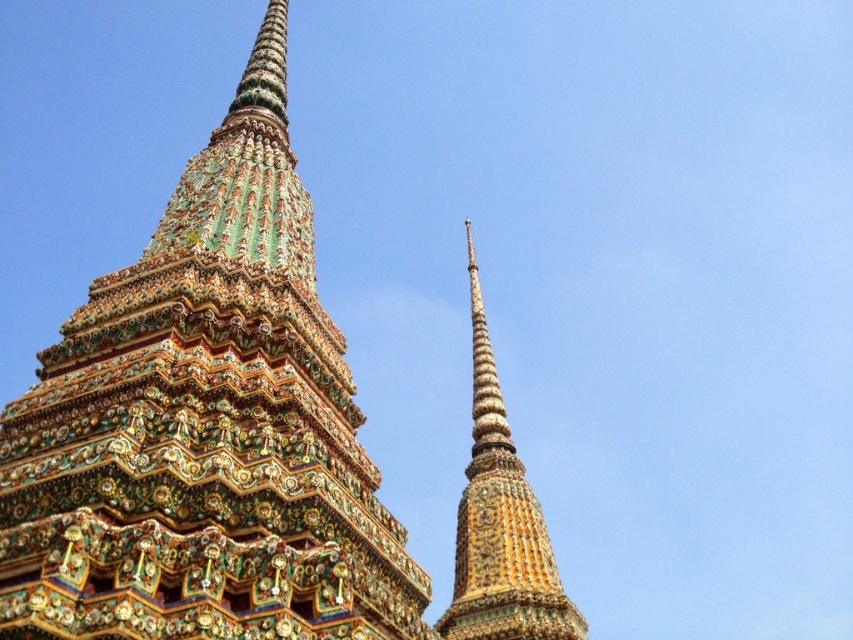
Can you confirm if multicolored mosaic temple spire at center is wider than gold/gilded stupa at center?

Indeed, multicolored mosaic temple spire at center has a greater width compared to gold/gilded stupa at center.

Does point (163, 392) come farther from viewer compared to point (521, 477)?

No.

You are a GUI agent. You are given a task and a screenshot of the screen. Output one action in this format:
    pyautogui.click(x=<x>, y=<y>)
    Task: Click on the multicolored mosaic temple spire at center
    This screenshot has width=853, height=640.
    Given the screenshot: What is the action you would take?
    pyautogui.click(x=204, y=428)